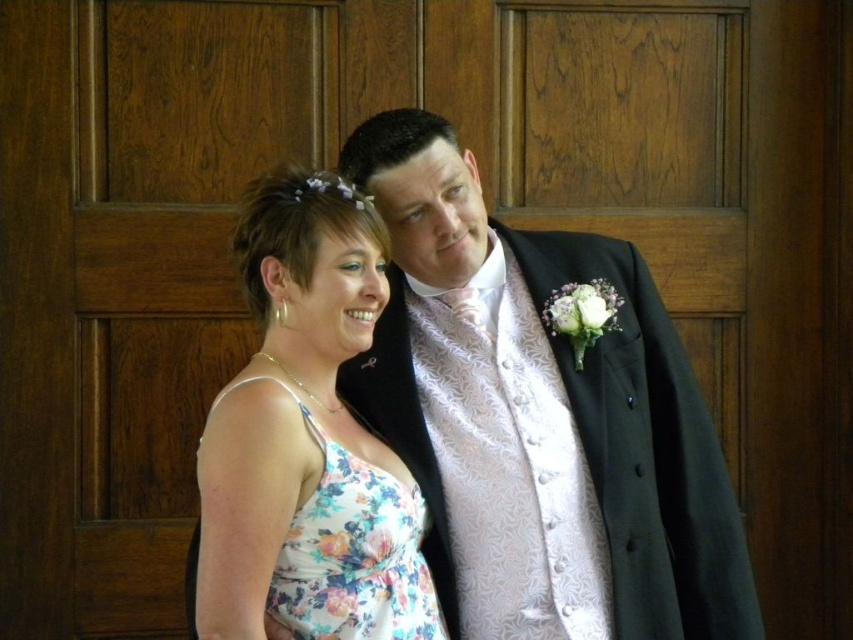
You are a photographer who wants to capture a clear photo of both the floral dress at center and the floral fabric dress at center in the image. The camera you are using has a focus range of 10 inches. Can both dresses be in focus at the same time?

The floral dress at center and floral fabric dress at center are 9.76 inches apart from each other, so yes, both can be in focus since the distance between them is within the camera focus range of 10 inches.

You are a photographer standing 6 feet away from the camera. You want to take a photo of the floral dress at center. Can you move closer to the dress to get a better shot?

The floral dress at center and camera are 5.25 feet apart. Since you are 6 feet away from the camera, moving closer would require reducing the distance between you and the dress. However, the existing distance between the dress and camera is shorter than your current position, so you can move closer to the floral dress at center to get a better shot as long as you stay within the 5.25 feet distance between the dress and the camera.

You are a photographer setting up for a group photo. You need to arrange the two people so that the floral dress at center and the floral fabric dress at center are visible. According to the image, which dress should be placed to the left to ensure both are visible in the frame?

The floral fabric dress at center should be placed to the left because the floral dress at center is positioned on the right side of it in the original image, so moving them accordingly keeps both visible.